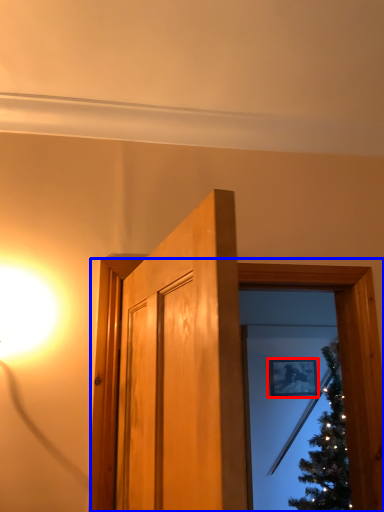
Question: Which object appears closest to the camera in this image, picture frame (highlighted by a red box) or window frame (highlighted by a blue box)?

Choices:
 (A) picture frame
 (B) window frame

Answer: (B)